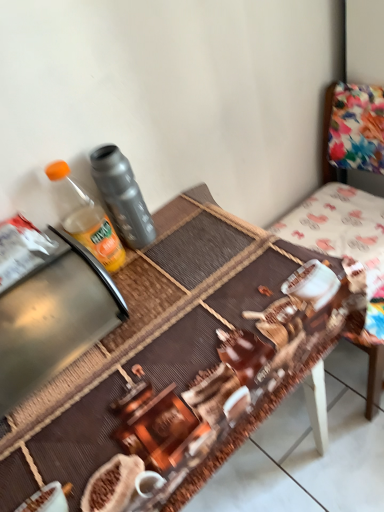
Locate an element on the screen. This screenshot has width=384, height=512. unoccupied region to the right of translucent plastic bottle at upper left, arranged as the second bottle when viewed from the right is located at coordinates (182, 237).